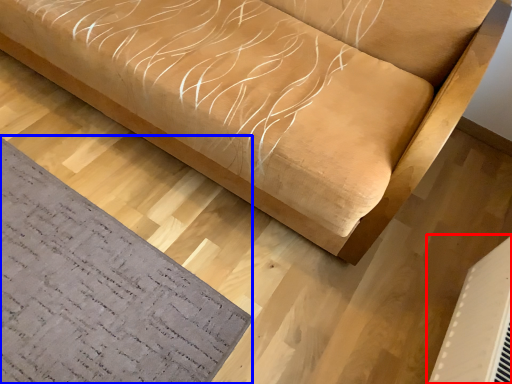
Question: Which object is further to the camera taking this photo, air conditioning (highlighted by a red box) or mat (highlighted by a blue box)?

Choices:
 (A) air conditioning
 (B) mat

Answer: (B)